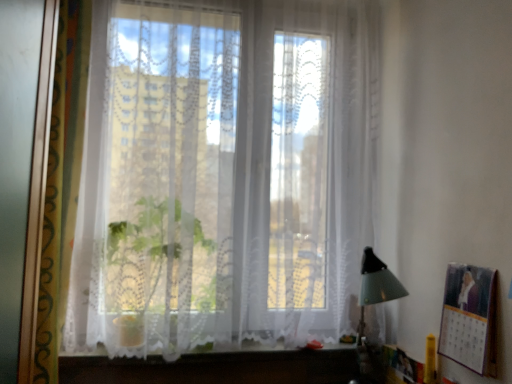
Identify the location of metallic silver picture frame at right. (469, 318).

What is the approximate height of white lace vanity at lower center?

white lace vanity at lower center is 4.53 centimeters tall.

Where is `metallic silver picture frame at right`? The image size is (512, 384). metallic silver picture frame at right is located at coordinates (469, 318).

Can you confirm if white lace vanity at lower center is thinner than metallic silver picture frame at right?

In fact, white lace vanity at lower center might be wider than metallic silver picture frame at right.

Is point (202, 376) closer or farther from the camera than point (485, 330)?

Point (202, 376) is farther from the camera than point (485, 330).

Does white lace vanity at lower center have a lesser height compared to metallic silver picture frame at right?

Indeed, white lace vanity at lower center has a lesser height compared to metallic silver picture frame at right.

Could you tell me if white lace vanity at lower center is turned towards metallic silver picture frame at right?

No, white lace vanity at lower center is not oriented towards metallic silver picture frame at right.

Can we say metallic silver picture frame at right lies outside transparent lace curtain at center?

Absolutely, metallic silver picture frame at right is external to transparent lace curtain at center.

Is the position of metallic silver picture frame at right less distant than that of transparent lace curtain at center?

Yes, it is in front of transparent lace curtain at center.

At what (x,y) coordinates should I click in order to perform the action: click on picture frame beneath the transparent lace curtain at center (from a real-world perspective). Please return your answer as a coordinate pair (x, y). The height and width of the screenshot is (384, 512). Looking at the image, I should click on (469, 318).

Considering the points (443, 342) and (352, 314), which point is behind, point (443, 342) or point (352, 314)?

The point (352, 314) is behind.

Is transparent lace curtain at center to the left or to the right of white lace vanity at lower center in the image?

From the image, it's evident that transparent lace curtain at center is to the right of white lace vanity at lower center.

Would you say transparent lace curtain at center is outside white lace vanity at lower center?

Yes, transparent lace curtain at center is not within white lace vanity at lower center.

From the image's perspective, is transparent lace curtain at center beneath white lace vanity at lower center?

No, from the image's perspective, transparent lace curtain at center is not below white lace vanity at lower center.

There is a white lace vanity at lower center. In order to click on window above it (from a real-world perspective) in this screenshot , I will do `click(224, 175)`.

Which of these two, metallic silver picture frame at right or white lace vanity at lower center, stands taller?

With more height is metallic silver picture frame at right.

From the image's perspective, which one is positioned higher, metallic silver picture frame at right or white lace vanity at lower center?

metallic silver picture frame at right is shown above in the image.

Is metallic silver picture frame at right positioned beyond the bounds of white lace vanity at lower center?

Absolutely, metallic silver picture frame at right is external to white lace vanity at lower center.

Does transparent lace curtain at center appear on the left side of metallic silver picture frame at right?

Correct, you'll find transparent lace curtain at center to the left of metallic silver picture frame at right.

Considering the sizes of objects transparent lace curtain at center and metallic silver picture frame at right in the image provided, who is wider, transparent lace curtain at center or metallic silver picture frame at right?

Wider between the two is transparent lace curtain at center.

There is a metallic silver picture frame at right. At what (x,y) coordinates should I click in order to perform the action: click on window above it (from a real-world perspective). Please return your answer as a coordinate pair (x, y). Looking at the image, I should click on (224, 175).

Considering the sizes of transparent lace curtain at center and metallic silver picture frame at right in the image, is transparent lace curtain at center bigger or smaller than metallic silver picture frame at right?

Clearly, transparent lace curtain at center is larger in size than metallic silver picture frame at right.

Is white lace vanity at lower center taller than transparent lace curtain at center?

Incorrect, the height of white lace vanity at lower center is not larger of that of transparent lace curtain at center.

Would you say transparent lace curtain at center is part of white lace vanity at lower center's contents?

No, transparent lace curtain at center is not surrounded by white lace vanity at lower center.

Is white lace vanity at lower center positioned before transparent lace curtain at center?

No, it is not.

The height and width of the screenshot is (384, 512). I want to click on window in front of the white lace vanity at lower center, so click(224, 175).

This screenshot has width=512, height=384. I want to click on picture frame that is on the right side of white lace vanity at lower center, so 469,318.

Find the location of a particular element. The height and width of the screenshot is (384, 512). picture frame below the transparent lace curtain at center (from the image's perspective) is located at coordinates (469, 318).

Considering their positions, is metallic silver picture frame at right positioned further to transparent lace curtain at center than white lace vanity at lower center?

metallic silver picture frame at right is positioned further to the anchor transparent lace curtain at center.

Estimate the real-world distances between objects in this image. Which object is closer to metallic silver picture frame at right, white lace vanity at lower center or transparent lace curtain at center?

white lace vanity at lower center is positioned closer to the anchor metallic silver picture frame at right.

Looking at this image, based on their spatial positions, is transparent lace curtain at center or metallic silver picture frame at right closer to white lace vanity at lower center?

transparent lace curtain at center.

When comparing their distances from white lace vanity at lower center, does metallic silver picture frame at right or transparent lace curtain at center seem closer?

transparent lace curtain at center is closer to white lace vanity at lower center.

Based on their spatial positions, is transparent lace curtain at center or white lace vanity at lower center further from metallic silver picture frame at right?

Among the two, transparent lace curtain at center is located further to metallic silver picture frame at right.

From the image, which object appears to be nearer to transparent lace curtain at center, white lace vanity at lower center or metallic silver picture frame at right?

Among the two, white lace vanity at lower center is located nearer to transparent lace curtain at center.

At what (x,y) coordinates should I click in order to perform the action: click on window between white lace vanity at lower center and metallic silver picture frame at right. Please return your answer as a coordinate pair (x, y). This screenshot has height=384, width=512. Looking at the image, I should click on (224, 175).